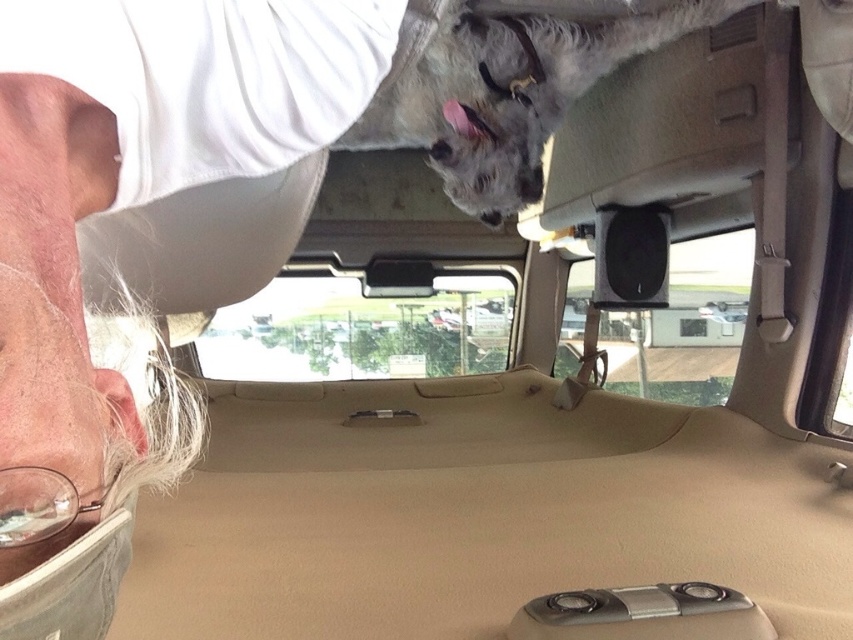
Question: Which object appears closest to the camera in this image?

Choices:
 (A) transparent glass car window at center
 (B) white fluffy dog at upper center

Answer: (B)

Question: Is gray fabric cap at upper left to the left of transparent glass car window at center from the viewer's perspective?

Choices:
 (A) no
 (B) yes

Answer: (A)

Question: Estimate the real-world distances between objects in this image. Which object is farther from the white fluffy dog at upper center?

Choices:
 (A) transparent glass car window at center
 (B) gray fabric cap at upper left

Answer: (A)

Question: Which point is farther from the camera taking this photo?

Choices:
 (A) pos(531,67)
 (B) pos(73,305)
 (C) pos(222,353)

Answer: (C)

Question: Observing the image, what is the correct spatial positioning of white fluffy dog at upper center in reference to transparent glass car window at center?

Choices:
 (A) above
 (B) below

Answer: (A)

Question: Does gray fabric cap at upper left appear on the right side of white fluffy dog at upper center?

Choices:
 (A) yes
 (B) no

Answer: (B)